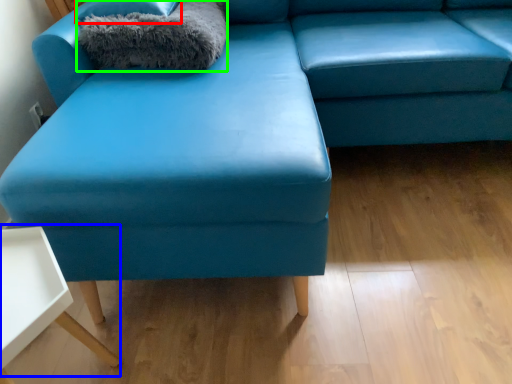
Question: Estimate the real-world distances between objects in this image. Which object is farther from pillow (highlighted by a red box), table (highlighted by a blue box) or blanket (highlighted by a green box)?

Choices:
 (A) table
 (B) blanket

Answer: (A)